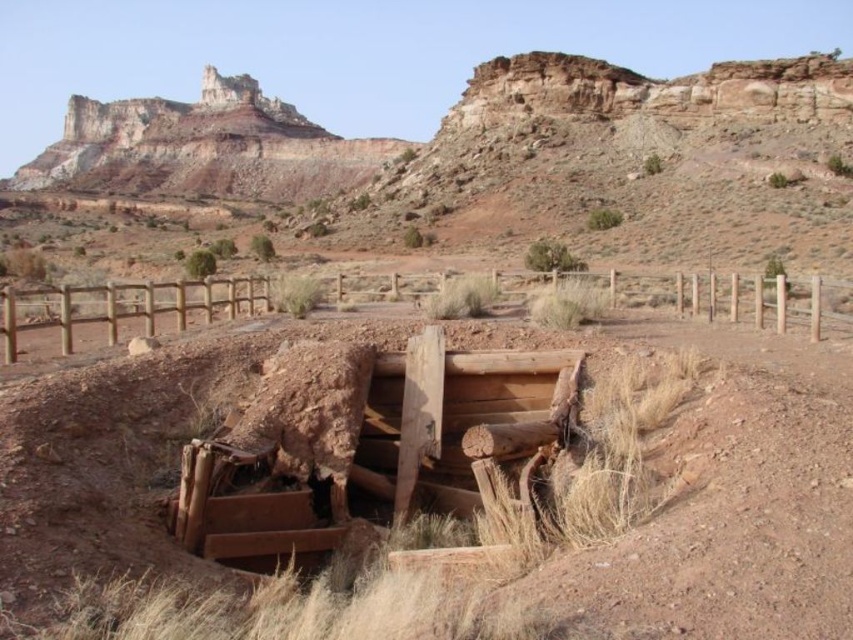
The width and height of the screenshot is (853, 640). What do you see at coordinates (724, 496) in the screenshot?
I see `brown rough wood at center` at bounding box center [724, 496].

Which is in front, point (602, 584) or point (668, 291)?

Point (602, 584) is more forward.

Identify the location of brown rough wood at center. The image size is (853, 640). (724, 496).